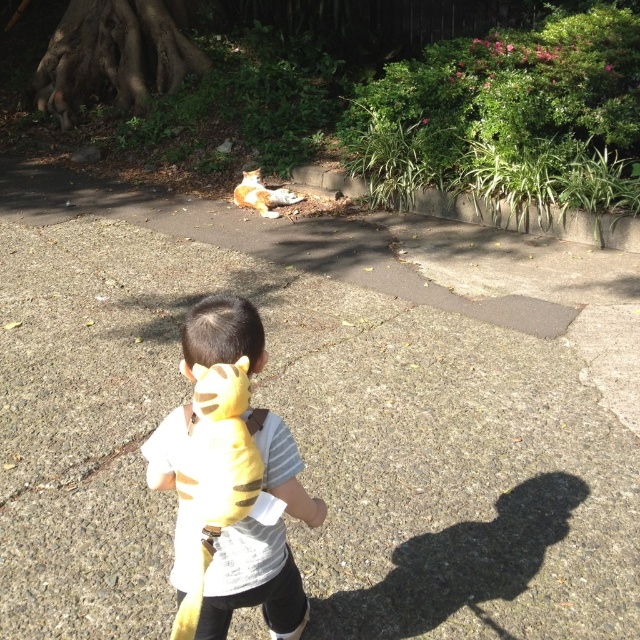
Between point (246, 454) and point (253, 172), which one is positioned in front?

Positioned in front is point (246, 454).

Is point (193, 484) more distant than point (276, 204)?

No, it is not.

Who is more forward, (221, 381) or (244, 184)?

Point (221, 381) is more forward.

Locate an element on the screen. yellow plush toy at back is located at coordinates (218, 468).

Can you confirm if yellow plush toy at center is positioned above yellow plush toy at back?

Actually, yellow plush toy at center is below yellow plush toy at back.

Is point (214, 458) closer to viewer compared to point (221, 381)?

No.

What are the coordinates of `yellow plush toy at center` in the screenshot? It's located at (228, 481).

Can you confirm if yellow plush toy at center is taller than orange fur cat at center?

Yes.

In the scene shown: Can you confirm if yellow plush toy at center is bigger than orange fur cat at center?

Yes, yellow plush toy at center is bigger than orange fur cat at center.

The height and width of the screenshot is (640, 640). What are the coordinates of `yellow plush toy at center` in the screenshot? It's located at (228, 481).